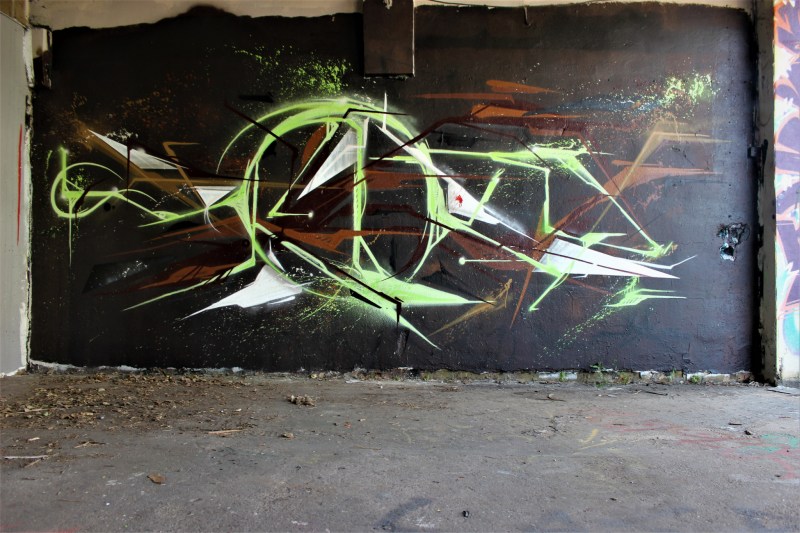
You are a GUI agent. You are given a task and a screenshot of the screen. Output one action in this format:
    pyautogui.click(x=<x>, y=<y>)
    Task: Click on the wall
    This screenshot has width=800, height=533.
    Given the screenshot: What is the action you would take?
    pyautogui.click(x=21, y=188), pyautogui.click(x=18, y=309)